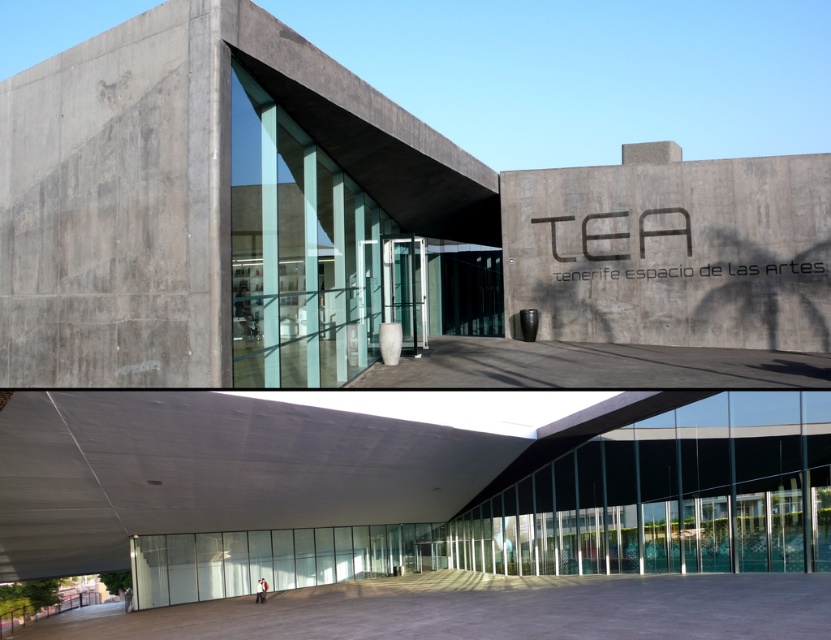
Between point (573, 628) and point (125, 593), which one is positioned in front?

Point (573, 628) is more forward.

Is point (792, 576) more distant than point (126, 602)?

No, it is in front of (126, 602).

Who is more forward, (493, 632) or (129, 589)?

Positioned in front is point (493, 632).

Identify the location of gray concrete at lower center. The height and width of the screenshot is (640, 831). (484, 609).

Is concrete wall at center to the right of gray concrete at lower center from the viewer's perspective?

Yes, concrete wall at center is to the right of gray concrete at lower center.

Which is above, concrete wall at center or gray concrete at lower center?

concrete wall at center is above.

Does point (85, 93) come closer to viewer compared to point (820, 618)?

Yes, point (85, 93) is in front of point (820, 618).

This screenshot has height=640, width=831. Identify the location of concrete wall at center. (347, 218).

Locate an element on the screen. concrete textured wall at center is located at coordinates (672, 250).

Who is higher up, concrete textured wall at center or light gray concrete person at center?

concrete textured wall at center is above.

Image resolution: width=831 pixels, height=640 pixels. I want to click on concrete textured wall at center, so click(672, 250).